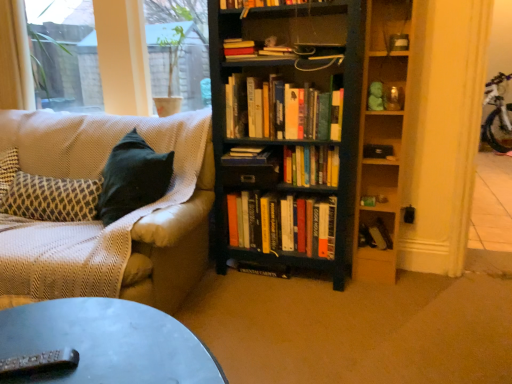
Question: From the image's perspective, is hardcover book at center, which appears as the first book when ordered from the bottom, located above or below textured beige couch at left?

Choices:
 (A) below
 (B) above

Answer: (A)

Question: From a real-world perspective, is hardcover book at center, which appears as the first book when ordered from the bottom, physically located above or below textured beige couch at left?

Choices:
 (A) above
 (B) below

Answer: (B)

Question: Estimate the real-world distances between objects in this image. Which object is closer to the hardcover books at center, arranged as the 5th book when ordered from the bottom?

Choices:
 (A) hardcover book at center, which appears as the first book when ordered from the bottom
 (B) metallic gray remote control at lower left
 (C) hardcover book at center, acting as the third book starting from the top
 (D) transparent glass window screen at upper left, which is the 2th window screen from left to right
 (E) patterned fabric pillow at left

Answer: (C)

Question: Which is nearer to the wooden shelf at upper right, which is the 1th shelf in top-to-bottom order?

Choices:
 (A) hardcover book at upper center, the 1th book from the top
 (B) transparent glass window at upper left, acting as the first window screen starting from the left
 (C) metallic gray remote control at lower left
 (D) transparent glass window screen at upper left, which is the 2th window screen from left to right
 (E) wooden shelves at right, which is the second shelf from top to bottom

Answer: (E)